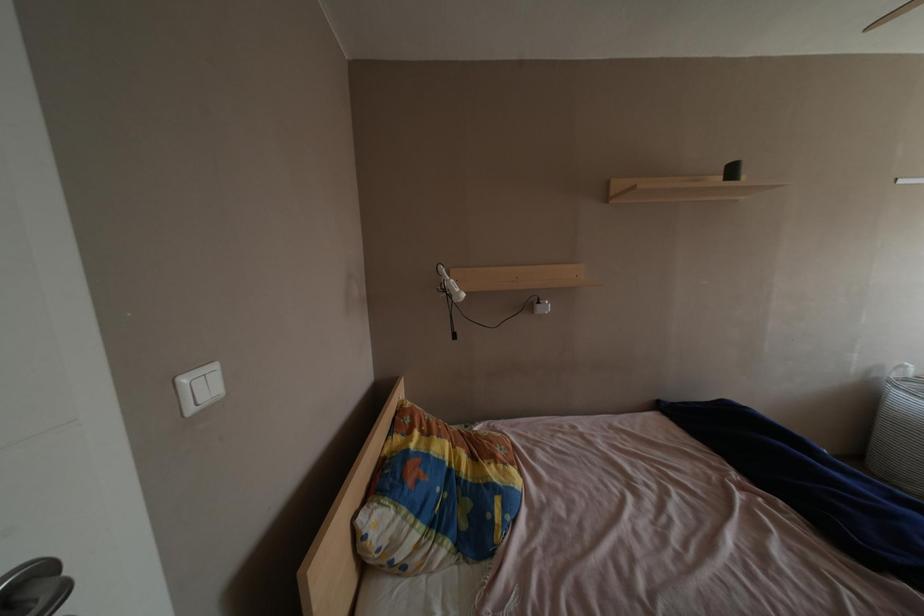
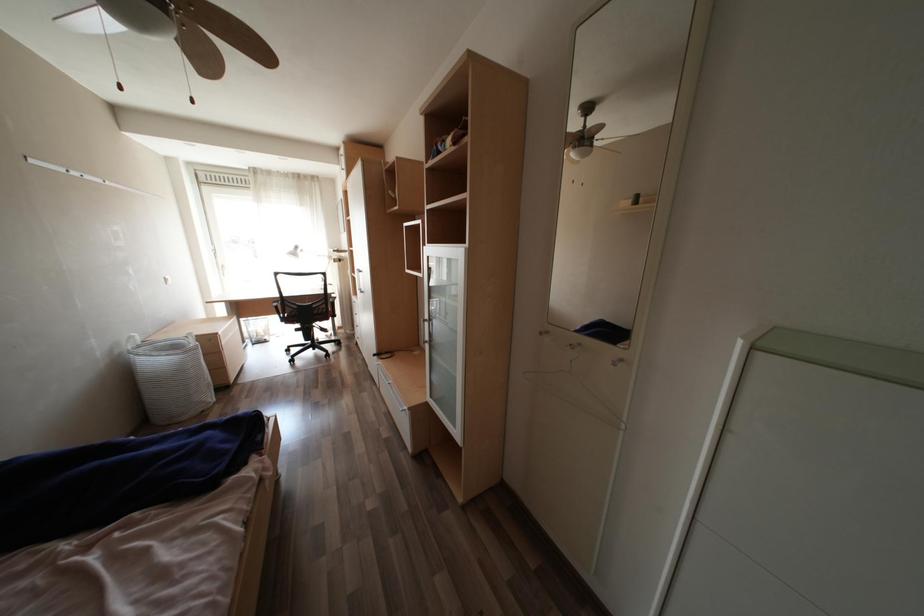
Based on the continuous images, in which direction is the camera rotating?

The camera rotated toward right-down.